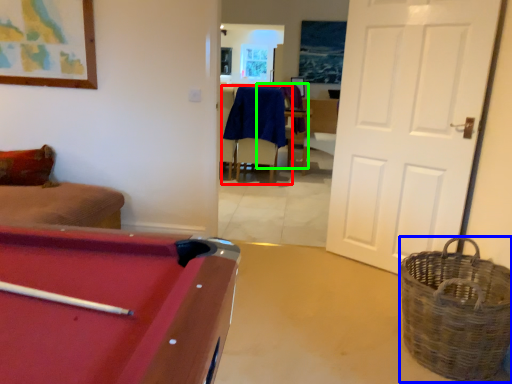
Question: Which object is positioned closest to chair (highlighted by a red box)? Select from basket (highlighted by a blue box) and armchair (highlighted by a green box).

Choices:
 (A) basket
 (B) armchair

Answer: (B)